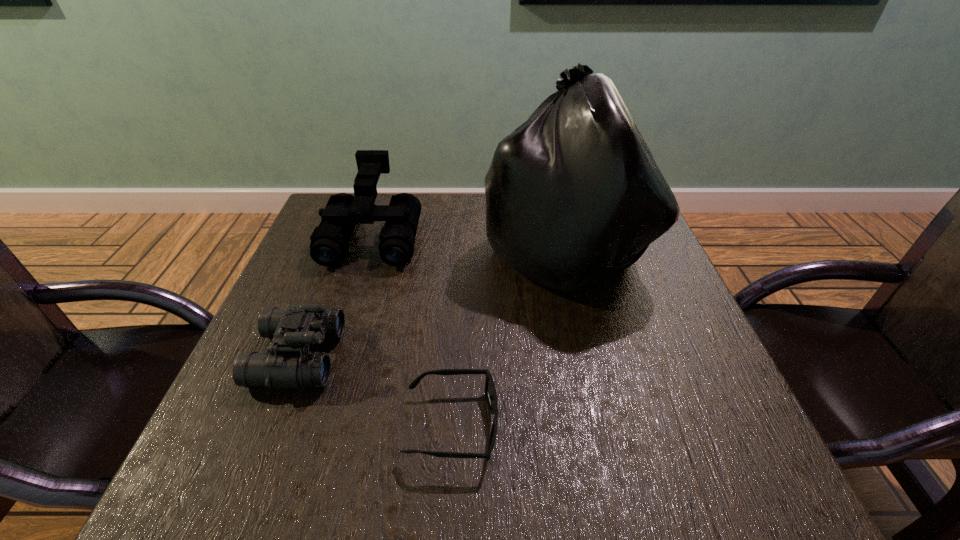
Where is `plastic bag that is at the far edge`? The height and width of the screenshot is (540, 960). plastic bag that is at the far edge is located at coordinates (573, 194).

Find the location of a particular element. binoculars that is at the far edge is located at coordinates (329, 243).

Find the location of a particular element. object that is at the near edge is located at coordinates (490, 391).

The image size is (960, 540). I want to click on object situated at the right edge, so click(x=573, y=194).

Find the location of a particular element. object that is at the far left corner is located at coordinates (329, 243).

I want to click on object that is at the far right corner, so click(573, 194).

Where is `vacant space at the far edge of the desktop`? vacant space at the far edge of the desktop is located at coordinates (470, 222).

Locate an element on the screen. This screenshot has height=540, width=960. vacant space at the near edge is located at coordinates (330, 489).

The image size is (960, 540). In order to click on free region at the left edge of the desktop in this screenshot , I will do `click(359, 272)`.

This screenshot has height=540, width=960. What are the coordinates of `blank space at the right edge of the desktop` in the screenshot? It's located at (733, 394).